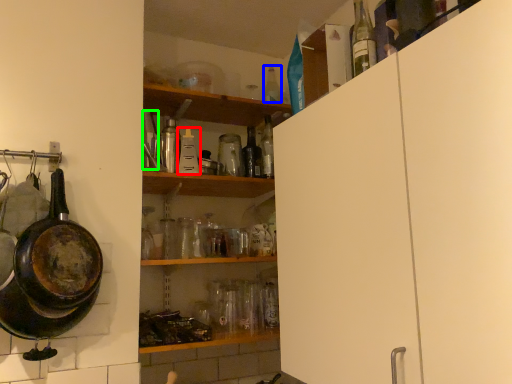
Question: Which object is positioned closest to bottle (highlighted by a red box)? Select from bottle (highlighted by a blue box) and bottle (highlighted by a green box).

Choices:
 (A) bottle
 (B) bottle

Answer: (B)